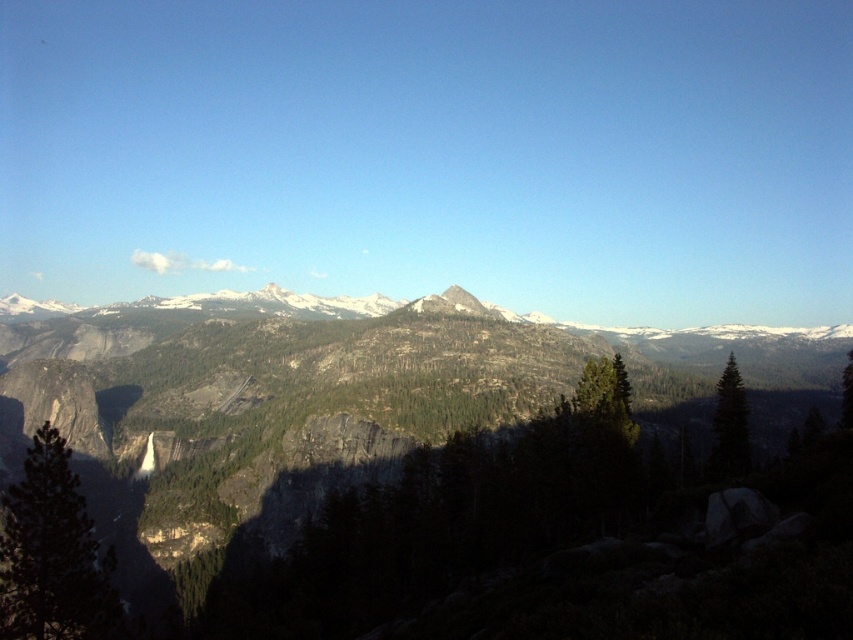
Question: Which point appears farthest from the camera in this image?

Choices:
 (A) (740, 387)
 (B) (614, 412)

Answer: (A)

Question: Which object is closer to the camera taking this photo?

Choices:
 (A) green matte tree at right
 (B) green matte tree at lower left
 (C) green matte tree at center

Answer: (B)

Question: Can you confirm if green matte tree at lower left is positioned above green matte tree at right?

Choices:
 (A) yes
 (B) no

Answer: (B)

Question: Observing the image, what is the correct spatial positioning of green matte tree at center in reference to green matte tree at right?

Choices:
 (A) right
 (B) left

Answer: (B)

Question: Can you confirm if green matte tree at lower left is positioned to the right of green matte tree at center?

Choices:
 (A) no
 (B) yes

Answer: (A)

Question: Which object is the closest to the green matte tree at right?

Choices:
 (A) green matte tree at center
 (B) green matte tree at lower left
 (C) rocky mountain range at center

Answer: (A)